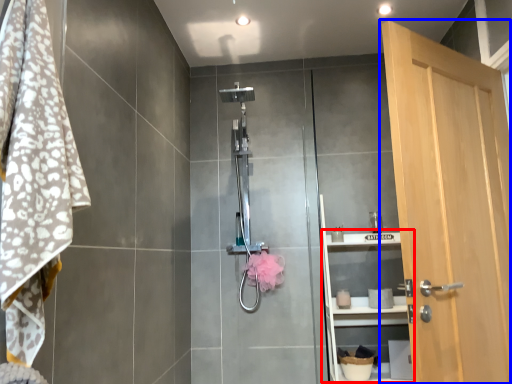
Question: Which object is further to the camera taking this photo, shelf (highlighted by a red box) or door (highlighted by a blue box)?

Choices:
 (A) shelf
 (B) door

Answer: (A)